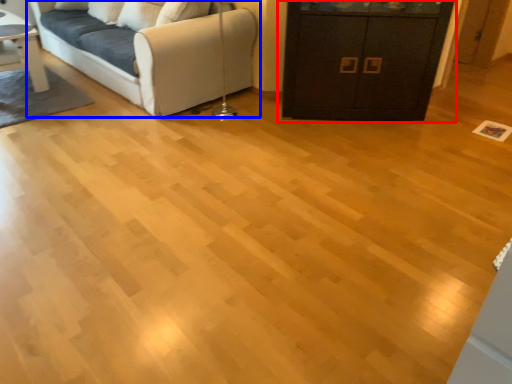
Question: Which point is further to the camera, cabinetry (highlighted by a red box) or studio couch (highlighted by a blue box)?

Choices:
 (A) cabinetry
 (B) studio couch

Answer: (B)